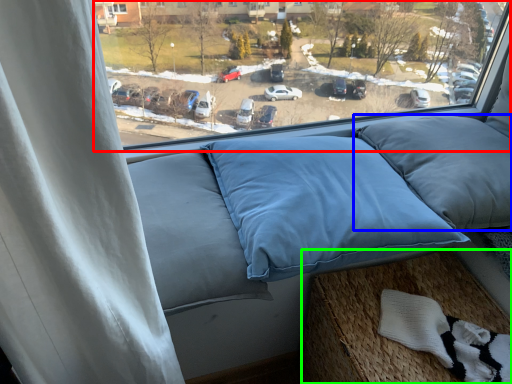
Question: Which is farther away from window (highlighted by a red box)? pillow (highlighted by a blue box) or bed frame (highlighted by a green box)?

Choices:
 (A) pillow
 (B) bed frame

Answer: (B)